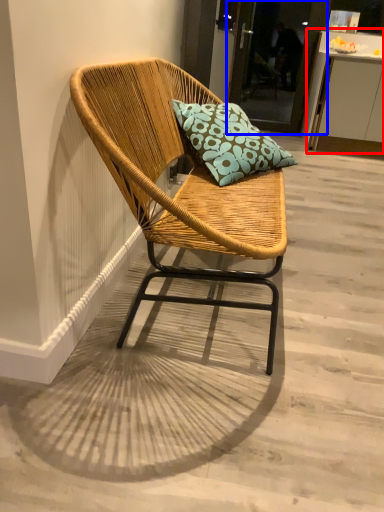
Question: Which object appears farthest to the camera in this image, table (highlighted by a red box) or glass door (highlighted by a blue box)?

Choices:
 (A) table
 (B) glass door

Answer: (B)